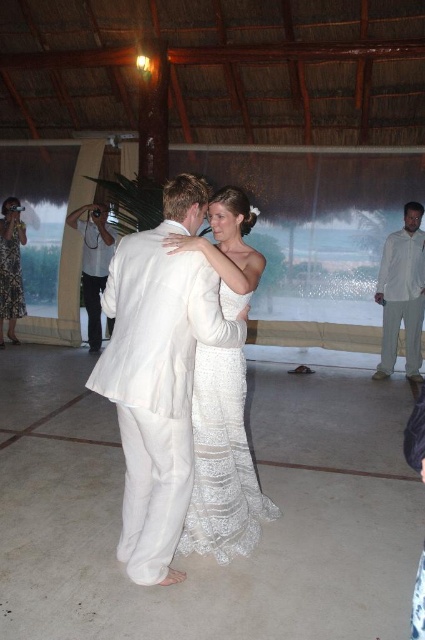
You are a photographer at the wedding and want to take a photo of the white lace dress at center and the white cotton camera at left. Which object is nearer to you?

The white lace dress at center is closer to the viewer than the white cotton camera at left, so the white lace dress at center is nearer to you.

You are a photographer at the wedding scene. You need to decide which clothing item occupies more visual space in the image to adjust your focus. Which one is larger between the white cotton pants at right and the white lace dress at left?

The white cotton pants at right is bigger than the white lace dress at left, so you should focus on the white cotton pants at right as it occupies more visual space.

You are a photographer at the wedding and you see the white lace dress at center and the white cotton camera at left. Which object is closer to the bottom of the image?

The white lace dress at center is positioned under the white cotton camera at left, so it is closer to the bottom of the image.